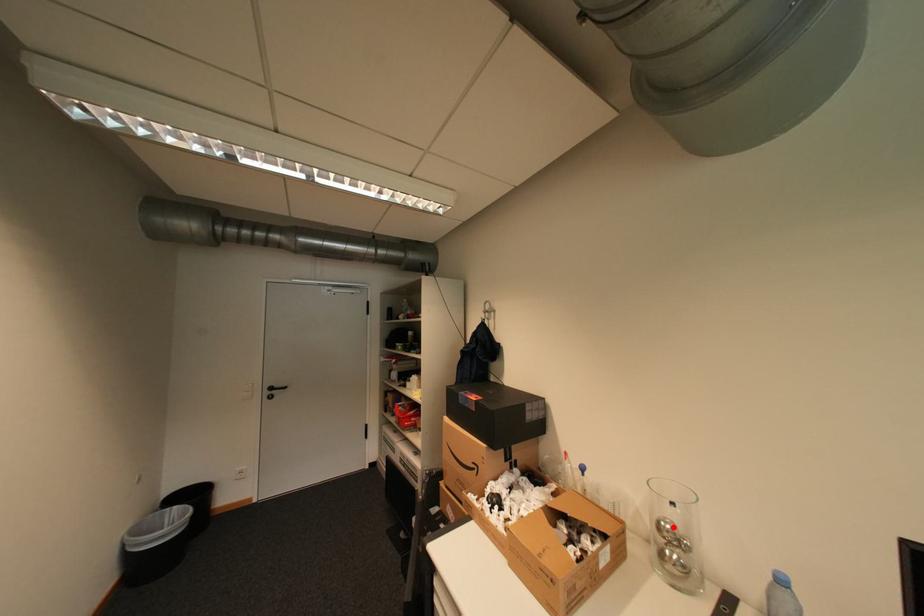
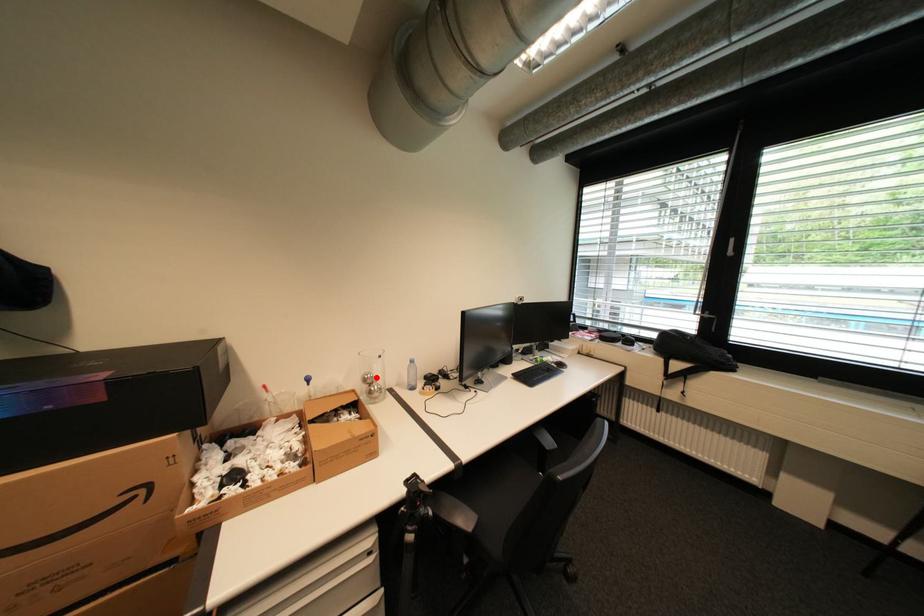
I am providing you with two images of the same scene from different viewpoints. A red point is marked on the first image and another point is marked on the second image. Does the point marked in image1 correspond to the same location as the one in image2?

Yes